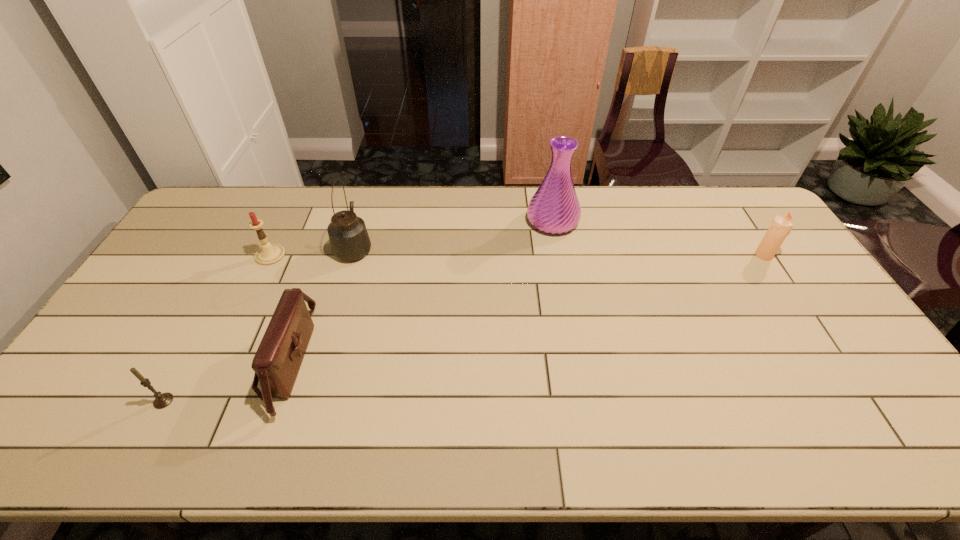
Where is `empty space between the kettle and the second object from right to left`? empty space between the kettle and the second object from right to left is located at coordinates (453, 234).

This screenshot has width=960, height=540. I want to click on vacant space that's between the leftmost object and the rightmost object, so click(464, 328).

Identify the location of free space that is in between the kettle and the shoulder bag. (x=321, y=303).

Find the location of `free space between the vase and the fifth object from right to left`. free space between the vase and the fifth object from right to left is located at coordinates (412, 238).

In order to click on vacant area between the leftmost candle and the fifth object from left to right in this screenshot , I will do `click(358, 311)`.

Find the location of a particular element. free space between the shoulder bag and the kettle is located at coordinates (321, 303).

Where is `vacant area between the rightmost object and the second object from left to right`? vacant area between the rightmost object and the second object from left to right is located at coordinates (517, 255).

The image size is (960, 540). In order to click on empty location between the shoulder bag and the nearest candle in this screenshot , I will do `click(225, 381)`.

The height and width of the screenshot is (540, 960). Identify the location of vacant space that is in between the second candle from left to right and the vase. (412, 238).

Identify the location of empty space between the fifth object from left to right and the kettle. (453, 234).